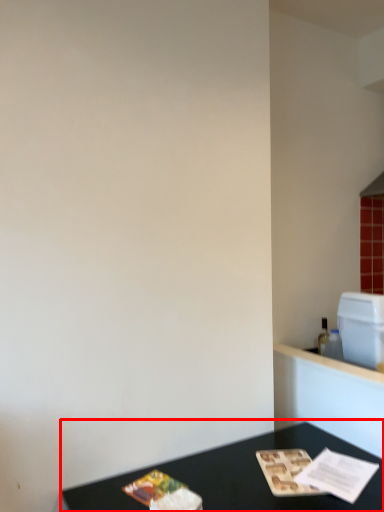
Question: Observing the image, what is the correct spatial positioning of table (annotated by the red box) in reference to appliance?

Choices:
 (A) left
 (B) right

Answer: (A)